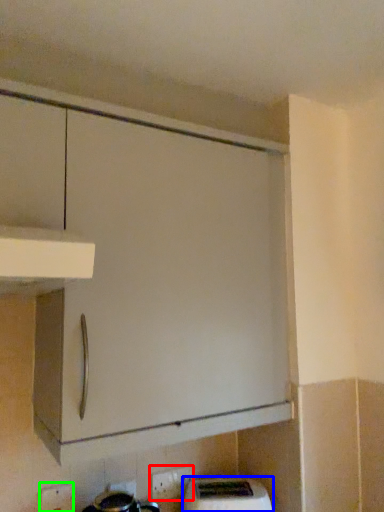
Question: Considering the real-world distances, which object is farthest from electric outlet (highlighted by a red box)? home appliance (highlighted by a blue box) or electric outlet (highlighted by a green box)?

Choices:
 (A) home appliance
 (B) electric outlet

Answer: (B)